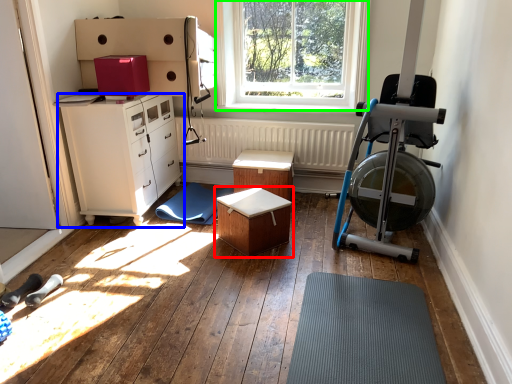
Question: Based on their relative distances, which object is farther from table (highlighted by a red box)? Choose from chest of drawers (highlighted by a blue box) and window (highlighted by a green box).

Choices:
 (A) chest of drawers
 (B) window

Answer: (B)